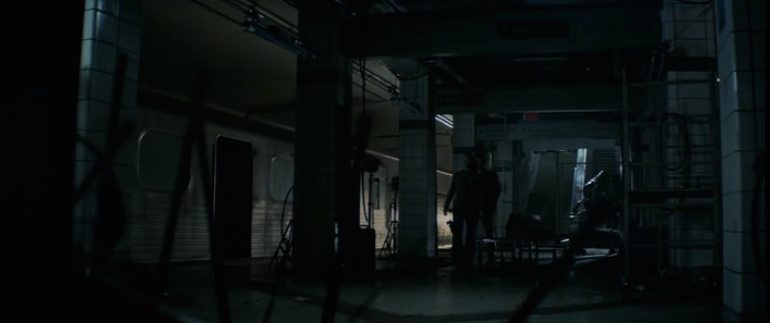
You are a GUI agent. You are given a task and a screenshot of the screen. Output one action in this format:
    pyautogui.click(x=<x>, y=<y>)
    Task: Click on the wall
    The width and height of the screenshot is (770, 323).
    Given the screenshot: What is the action you would take?
    pyautogui.click(x=697, y=159)